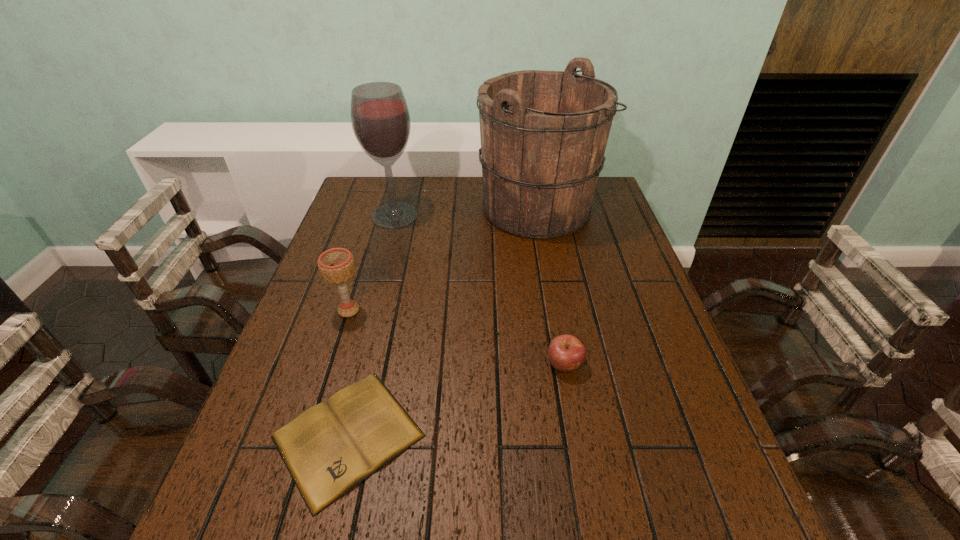
I want to click on bucket, so click(543, 134).

This screenshot has width=960, height=540. What are the coordinates of `alcohol` in the screenshot? It's located at click(x=380, y=119).

I want to click on the third farthest object, so click(336, 265).

Identify the location of the third shortest object. (336, 265).

Where is `the fourth tallest object`? The height and width of the screenshot is (540, 960). the fourth tallest object is located at coordinates (566, 353).

This screenshot has height=540, width=960. Identify the location of the shortest object. (331, 447).

This screenshot has height=540, width=960. What are the coordinates of `vacant space located 0.050m on the left of the bucket` in the screenshot? It's located at (462, 208).

At what (x,y) coordinates should I click in order to perform the action: click on free space located on the front of the alcohol. Please return your answer as a coordinate pair (x, y). The image size is (960, 540). Looking at the image, I should click on (371, 308).

Locate an element on the screen. The height and width of the screenshot is (540, 960). vacant space located 0.140m on the front of the chalice is located at coordinates (330, 367).

At what (x,y) coordinates should I click in order to perform the action: click on vacant space located on the side of the apple with the unique marking. Please return your answer as a coordinate pair (x, y). Looking at the image, I should click on (593, 521).